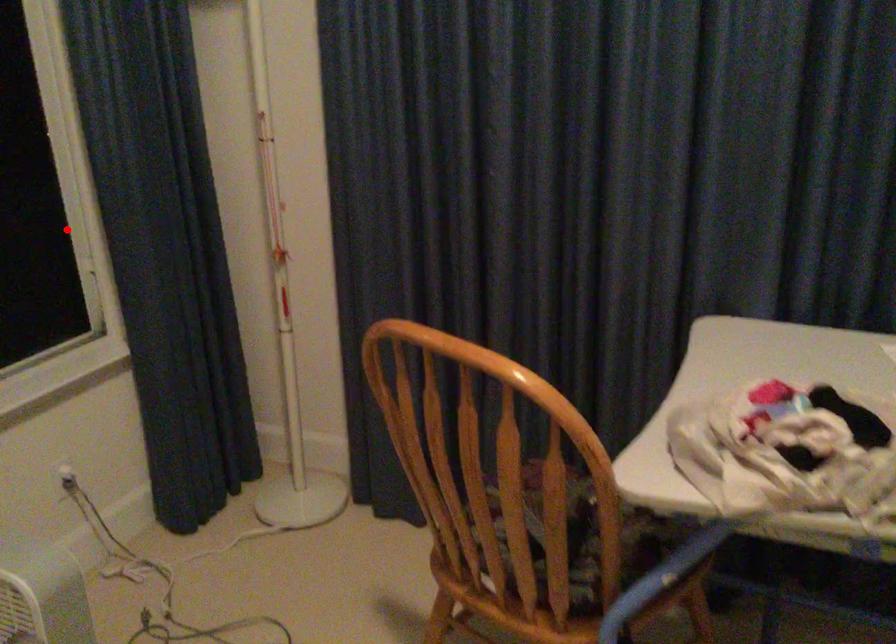
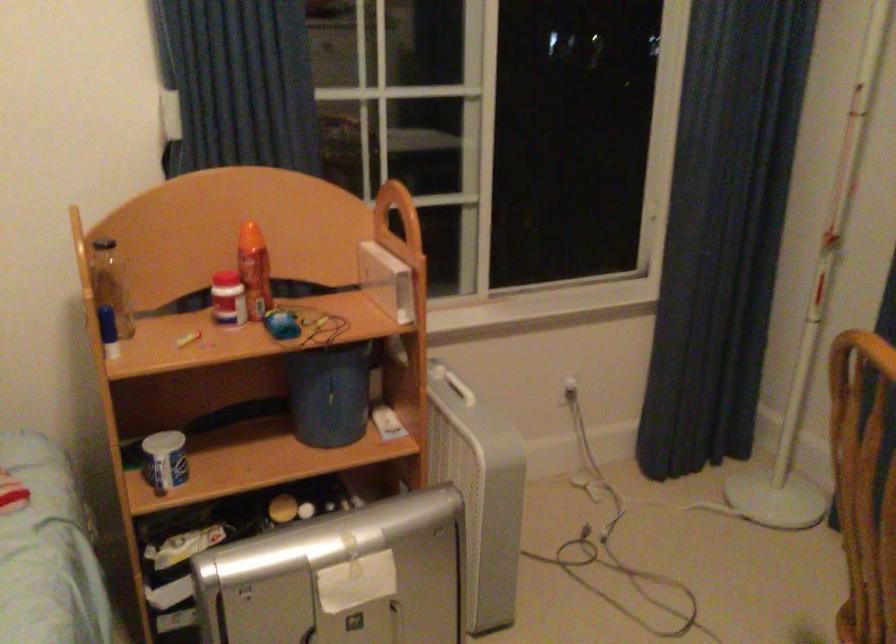
Question: I am providing you with two images of the same scene from different viewpoints. A red point is marked on the first image. At the location where the point appears in image 1, is it still visible in image 2?

Choices:
 (A) Yes
 (B) No

Answer: (B)